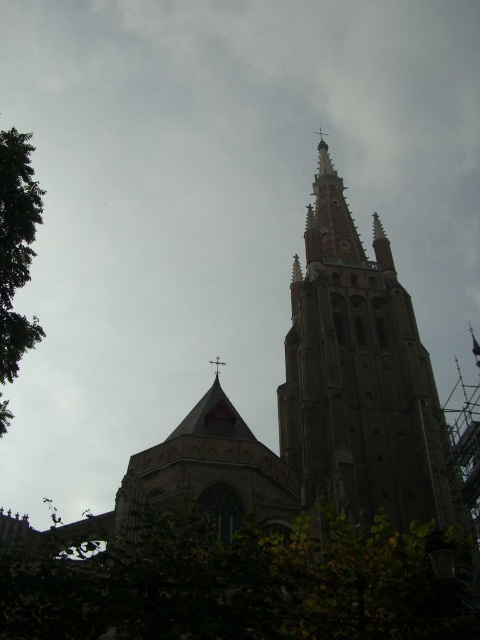
Is point (178, 524) farther from camera compared to point (27, 243)?

That is False.

Between green leafy tree at lower center and green leafy tree at left, which one is positioned higher?

green leafy tree at left

Does point (24, 637) come in front of point (15, 141)?

Yes, point (24, 637) is in front of point (15, 141).

At what (x,y) coordinates should I click in order to perform the action: click on green leafy tree at lower center. Please return your answer as a coordinate pair (x, y). The image size is (480, 640). Looking at the image, I should click on (240, 582).

Does brown stone tower at center have a greater height compared to green leafy tree at left?

Indeed, brown stone tower at center has a greater height compared to green leafy tree at left.

Can you confirm if brown stone tower at center is positioned above green leafy tree at left?

Indeed, brown stone tower at center is positioned over green leafy tree at left.

Identify the location of brown stone tower at center. The height and width of the screenshot is (640, 480). (360, 378).

Is green leafy tree at lower center closer to the viewer compared to brown stone tower at center?

Yes, green leafy tree at lower center is in front of brown stone tower at center.

Is green leafy tree at lower center to the left of brown stone tower at center from the viewer's perspective?

Yes, green leafy tree at lower center is to the left of brown stone tower at center.

Who is more forward, (239, 596) or (303, 232)?

Point (239, 596) is more forward.

Find the location of `green leafy tree at lower center`. green leafy tree at lower center is located at coordinates (240, 582).